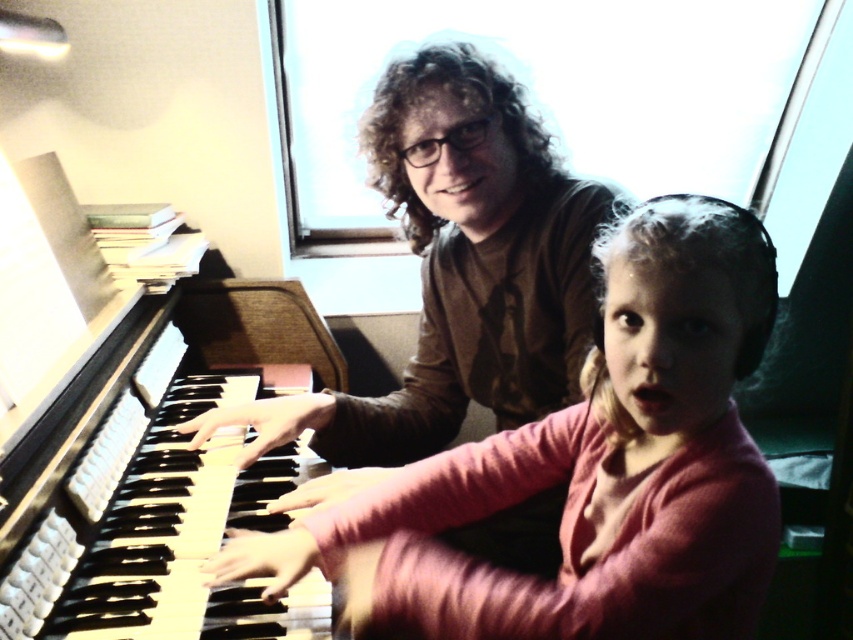
Is wooden piano keys at left bigger than matte brown shirt at upper center?

Indeed, wooden piano keys at left has a larger size compared to matte brown shirt at upper center.

Does wooden piano keys at left appear over matte brown shirt at upper center?

Actually, wooden piano keys at left is below matte brown shirt at upper center.

Does point (42, 628) come closer to viewer compared to point (363, 428)?

Yes, point (42, 628) is in front of point (363, 428).

You are a GUI agent. You are given a task and a screenshot of the screen. Output one action in this format:
    pyautogui.click(x=<x>, y=<y>)
    Task: Click on the wooden piano keys at left
    The height and width of the screenshot is (640, 853).
    Given the screenshot: What is the action you would take?
    pyautogui.click(x=154, y=483)

Does pink matte shirt at center appear under wooden piano keys at left?

Indeed, pink matte shirt at center is positioned under wooden piano keys at left.

Can you confirm if pink matte shirt at center is thinner than wooden piano keys at left?

In fact, pink matte shirt at center might be wider than wooden piano keys at left.

Does point (248, 547) lie in front of point (131, 403)?

Yes.

Identify the location of pink matte shirt at center. The image size is (853, 640). (589, 468).

Does point (442, 576) come farther from viewer compared to point (467, 164)?

No.

Measure the distance between point (x=691, y=532) and camera.

They are 28.75 inches apart.

Which is behind, point (593, 484) or point (437, 436)?

The point (437, 436) is behind.

You are a GUI agent. You are given a task and a screenshot of the screen. Output one action in this format:
    pyautogui.click(x=<x>, y=<y>)
    Task: Click on the pink matte shirt at center
    The height and width of the screenshot is (640, 853).
    Given the screenshot: What is the action you would take?
    pyautogui.click(x=589, y=468)